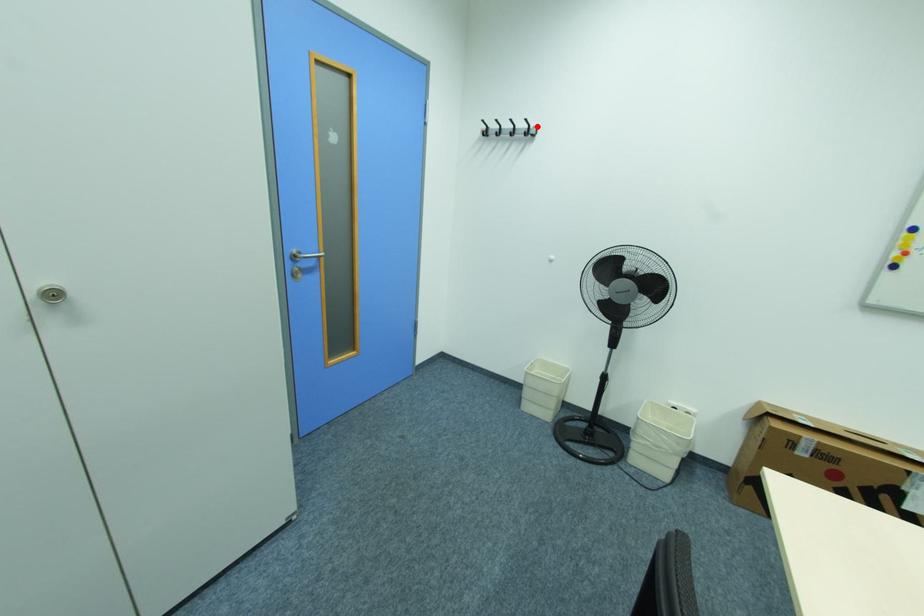
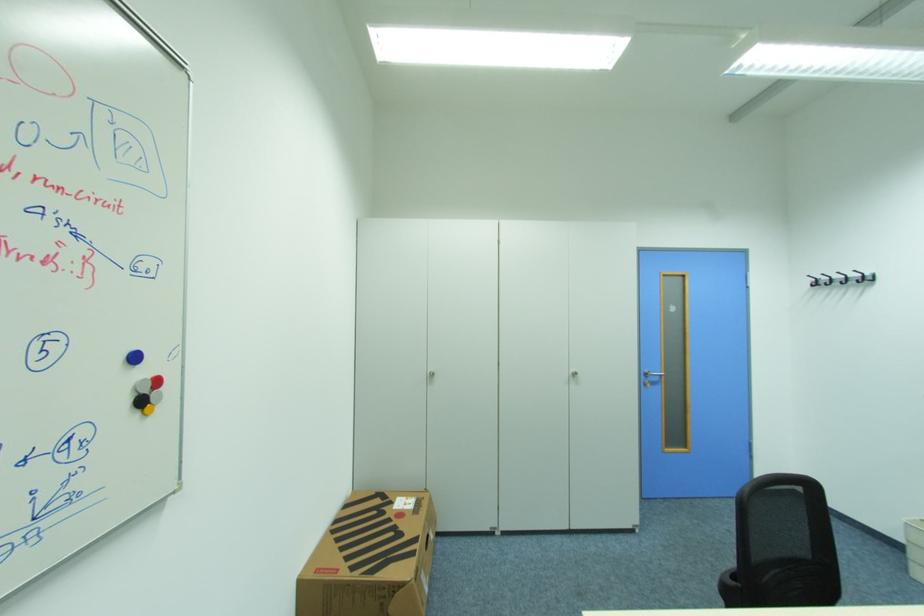
The point at the highlighted location is marked in the first image. Where is the corresponding point in the second image?

(872, 275)